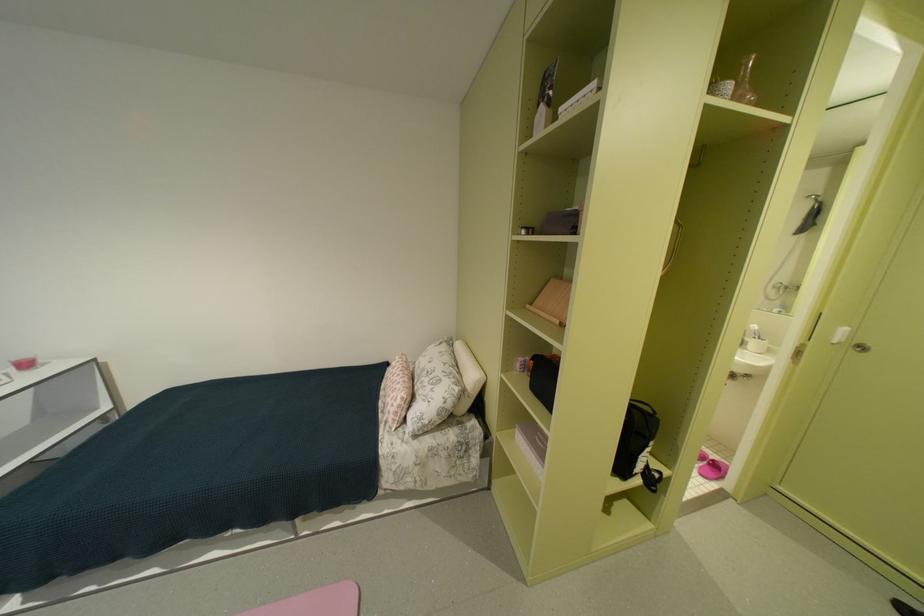
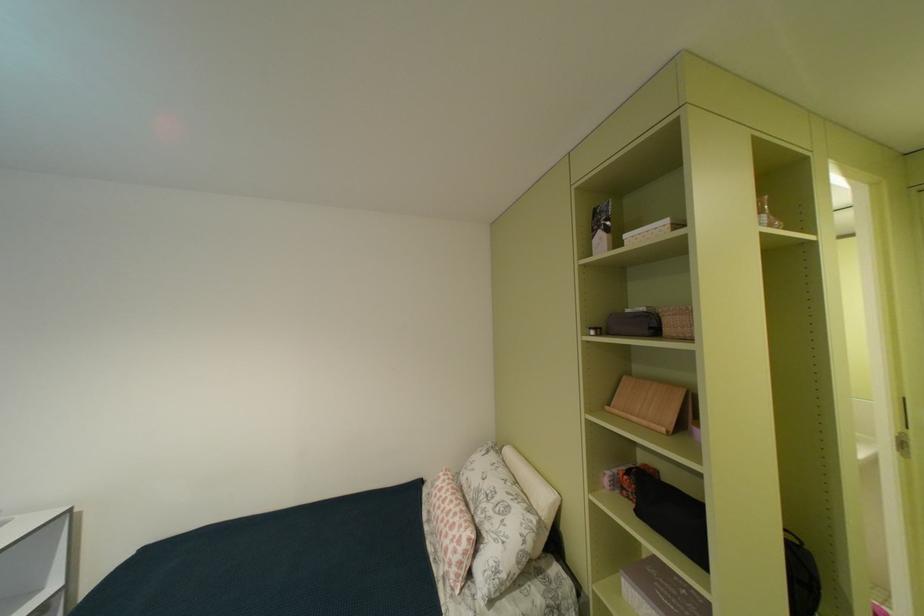
Locate, in the second image, the point that corresponds to pixel 106 410 in the first image.

(49, 591)